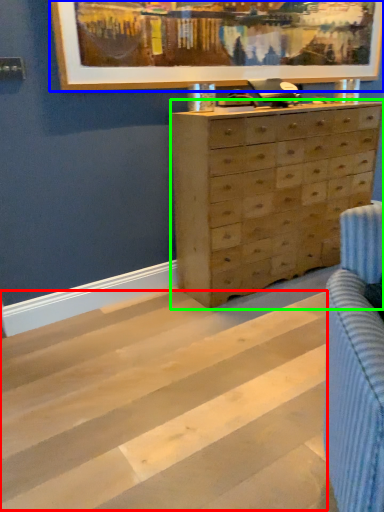
Question: Based on their relative distances, which object is farther from stripe (highlighted by a red box)? Choose from picture frame (highlighted by a blue box) and chest of drawers (highlighted by a green box).

Choices:
 (A) picture frame
 (B) chest of drawers

Answer: (A)